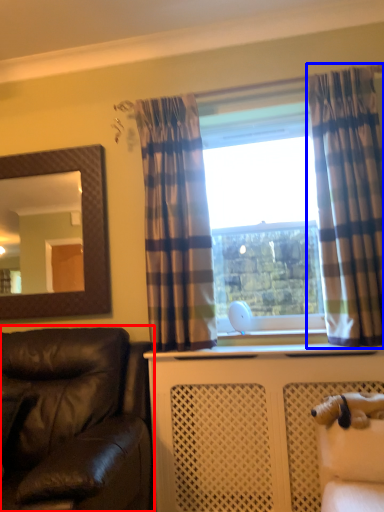
Question: Which of the following is the closest to the observer, studio couch (highlighted by a red box) or curtain (highlighted by a blue box)?

Choices:
 (A) studio couch
 (B) curtain

Answer: (A)